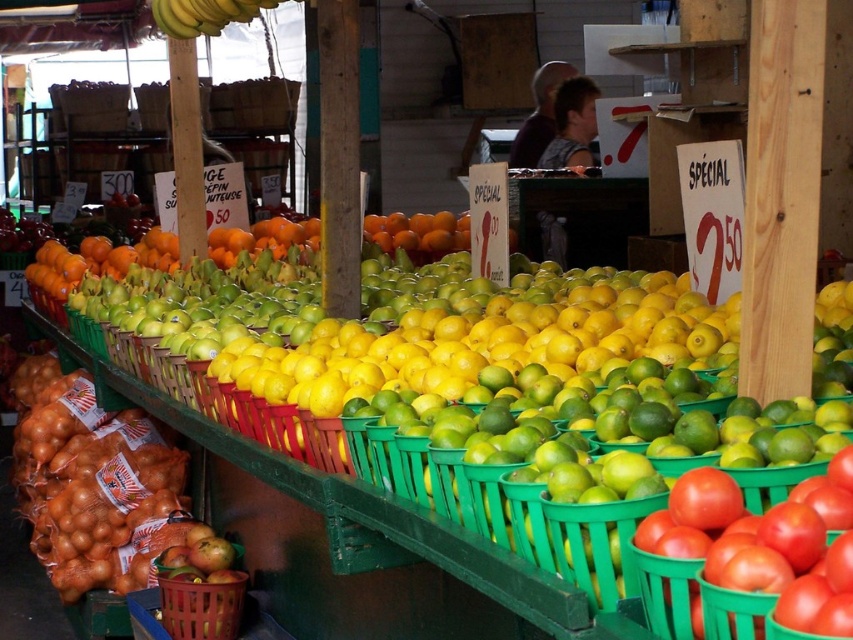
Question: Is brown papery onion at lower left further to camera compared to matte brown basket at lower left?

Choices:
 (A) yes
 (B) no

Answer: (A)

Question: Among these objects, which one is nearest to the camera?

Choices:
 (A) matte brown basket at lower left
 (B) shiny red tomato at lower right

Answer: (B)

Question: Which point is closer to the camera taking this photo?

Choices:
 (A) [85, 500]
 (B) [223, 616]

Answer: (B)

Question: Which point is farther to the camera?

Choices:
 (A) matte brown basket at lower left
 (B) shiny red tomato at lower right
 (C) brown papery onion at lower left

Answer: (C)

Question: Does brown papery onion at lower left appear under shiny red tomato at lower right?

Choices:
 (A) yes
 (B) no

Answer: (A)

Question: Considering the relative positions of shiny red tomato at lower right and matte brown basket at lower left in the image provided, where is shiny red tomato at lower right located with respect to matte brown basket at lower left?

Choices:
 (A) right
 (B) left

Answer: (A)